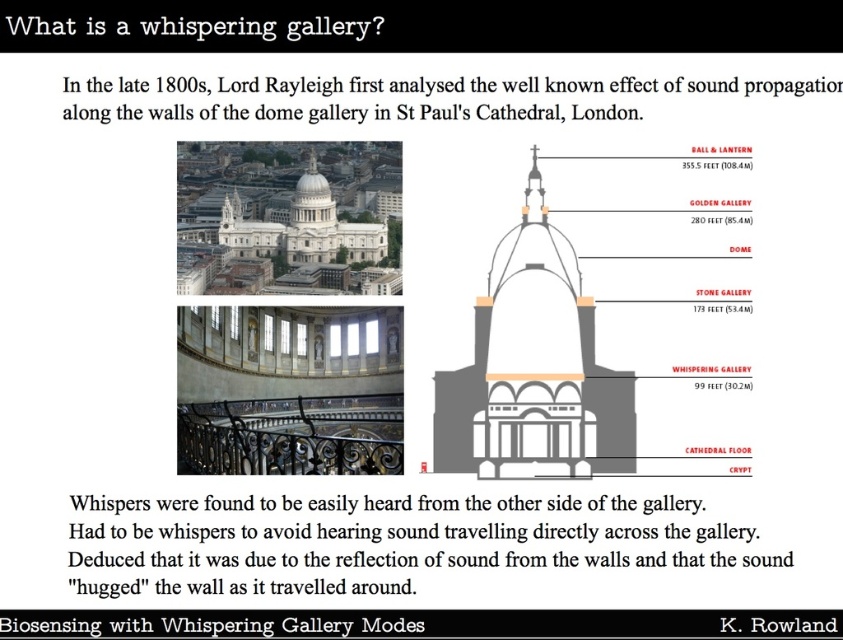
Question: Does white stone dome at center come behind white stone church at upper center?

Choices:
 (A) yes
 (B) no

Answer: (B)

Question: Is white stone dome at center above white stone church at upper center?

Choices:
 (A) no
 (B) yes

Answer: (A)

Question: Does white stone dome at center appear over white stone church at upper center?

Choices:
 (A) yes
 (B) no

Answer: (B)